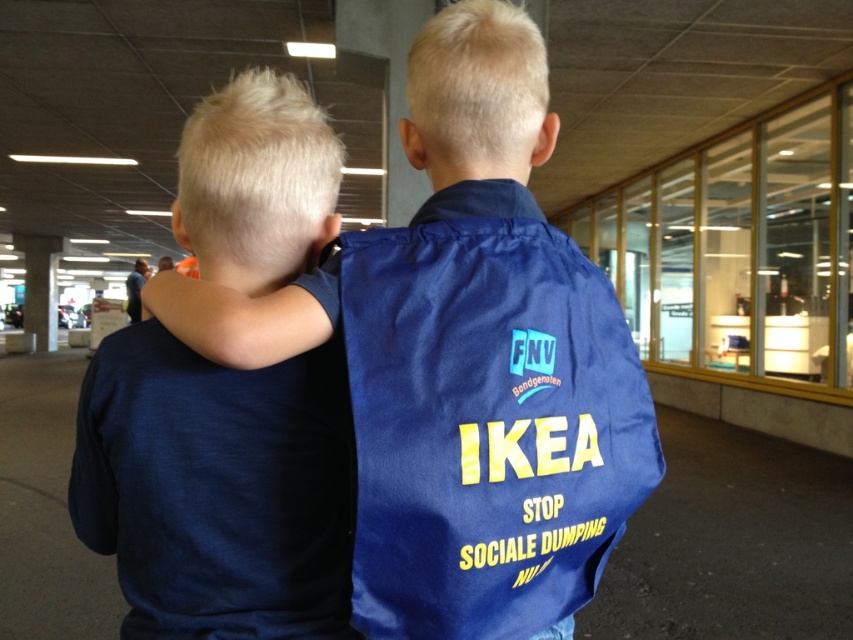
You are a photographer trying to capture a photo of the navy blue shirt at center and the smooth concrete pillar at center. From the perspective of the photographer, which object is located to the right?

The navy blue shirt at center is positioned on the right side of smooth concrete pillar at center, so from the photographer perspective, the navy blue shirt at center is to the right of the smooth concrete pillar at center.

You are a photographer trying to capture both the navy blue shirt at center and the smooth concrete pillar at center in a single frame. Based on their sizes, which object will occupy more space in the photo?

The smooth concrete pillar at center will occupy more space in the photo because it is larger than the navy blue shirt at center.